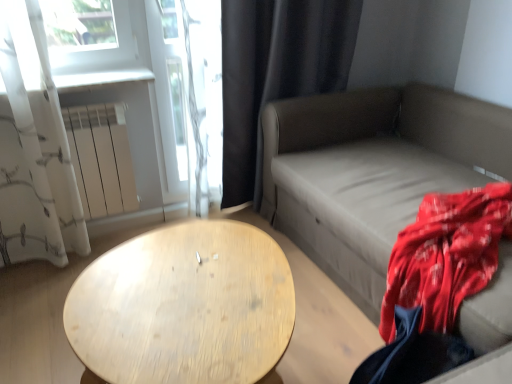
Question: Is matte gray couch at right located outside light wood/texture table at center?

Choices:
 (A) yes
 (B) no

Answer: (A)

Question: Is matte gray couch at right bigger than light wood/texture table at center?

Choices:
 (A) no
 (B) yes

Answer: (B)

Question: From a real-world perspective, is matte gray couch at right physically above light wood/texture table at center?

Choices:
 (A) no
 (B) yes

Answer: (B)

Question: Considering the relative sizes of matte gray couch at right and light wood/texture table at center in the image provided, is matte gray couch at right taller than light wood/texture table at center?

Choices:
 (A) yes
 (B) no

Answer: (A)

Question: From a real-world perspective, is matte gray couch at right positioned under light wood/texture table at center based on gravity?

Choices:
 (A) yes
 (B) no

Answer: (B)

Question: Considering their positions, is light wood/texture table at center located in front of or behind matte gray couch at right?

Choices:
 (A) front
 (B) behind

Answer: (A)

Question: Is light wood/texture table at center spatially inside matte gray couch at right, or outside of it?

Choices:
 (A) inside
 (B) outside

Answer: (B)

Question: From the image's perspective, is light wood/texture table at center positioned above or below matte gray couch at right?

Choices:
 (A) below
 (B) above

Answer: (A)

Question: Based on their positions, is light wood/texture table at center located to the left or right of matte gray couch at right?

Choices:
 (A) left
 (B) right

Answer: (A)

Question: From a real-world perspective, is black fabric curtain at upper right, the first curtain viewed from the right, positioned above or below light wood/texture table at center?

Choices:
 (A) above
 (B) below

Answer: (A)

Question: From the image's perspective, relative to light wood/texture table at center, is black fabric curtain at upper right, the 2th curtain positioned from the left, above or below?

Choices:
 (A) below
 (B) above

Answer: (B)

Question: Considering the positions of point click(239, 178) and point click(146, 382), is point click(239, 178) closer or farther from the camera than point click(146, 382)?

Choices:
 (A) farther
 (B) closer

Answer: (A)

Question: Relative to light wood/texture table at center, is black fabric curtain at upper right, the 2th curtain positioned from the left, in front or behind?

Choices:
 (A) behind
 (B) front

Answer: (A)

Question: From the image's perspective, is white matte radiator at left positioned above or below white sheer curtain at left, the 1th curtain viewed from the left?

Choices:
 (A) above
 (B) below

Answer: (B)

Question: Based on their sizes in the image, would you say white matte radiator at left is bigger or smaller than white sheer curtain at left, the 1th curtain viewed from the left?

Choices:
 (A) big
 (B) small

Answer: (B)